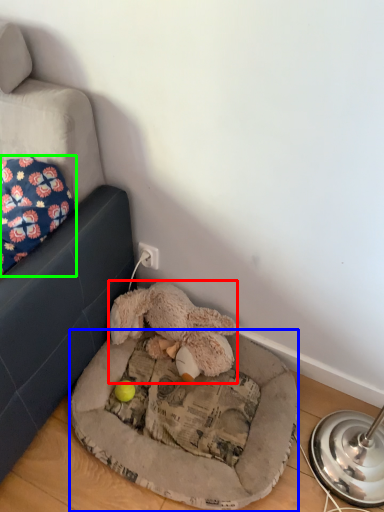
Question: Which object is positioned farthest from toy (highlighted by a red box)? Select from dog bed (highlighted by a blue box) and pillow (highlighted by a green box).

Choices:
 (A) dog bed
 (B) pillow

Answer: (B)